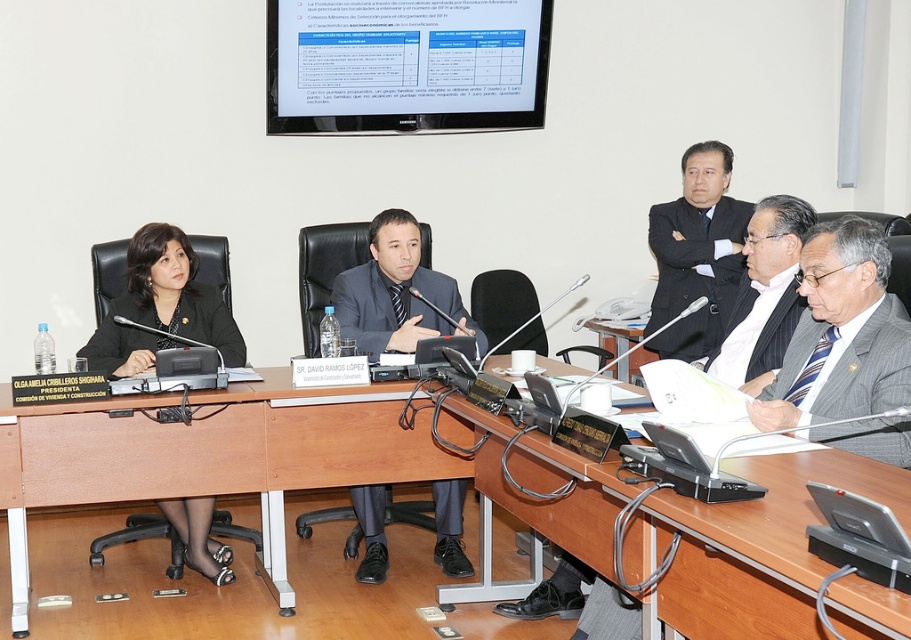
Is brown wood table at center in front of white glossy screen at upper center?

That is True.

Does brown wood table at center appear on the right side of white glossy screen at upper center?

Yes, brown wood table at center is to the right of white glossy screen at upper center.

The width and height of the screenshot is (911, 640). What do you see at coordinates (285, 461) in the screenshot? I see `brown wood table at center` at bounding box center [285, 461].

Find the location of a particular element. Image resolution: width=911 pixels, height=640 pixels. brown wood table at center is located at coordinates (285, 461).

Can you confirm if matte black suit at left is wider than dark gray suit at upper right?

Indeed, matte black suit at left has a greater width compared to dark gray suit at upper right.

Is matte black suit at left to the left of dark gray suit at upper right from the viewer's perspective?

Correct, you'll find matte black suit at left to the left of dark gray suit at upper right.

Where is `matte black suit at left`? The image size is (911, 640). matte black suit at left is located at coordinates (161, 307).

This screenshot has height=640, width=911. What are the coordinates of `matte black suit at left` in the screenshot? It's located at (161, 307).

Is point (195, 294) positioned in front of point (377, 529)?

That is True.

Does matte black suit at left have a smaller size compared to dark gray suit at center?

Actually, matte black suit at left might be larger than dark gray suit at center.

Does point (212, 572) come behind point (469, 323)?

No.

The height and width of the screenshot is (640, 911). What are the coordinates of `matte black suit at left` in the screenshot? It's located at (161, 307).